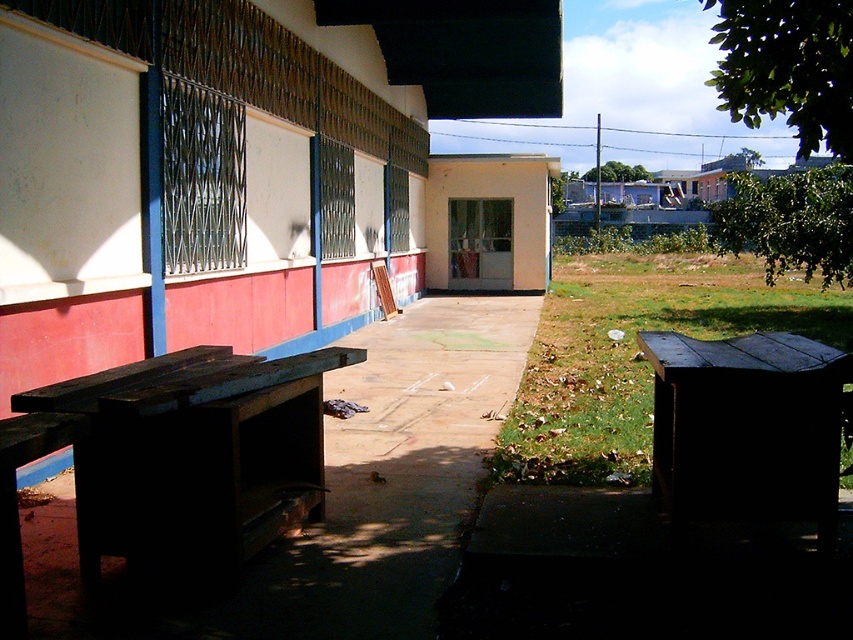
You are a visitor at this outdoor area and need to sit down. Which object, the dark wood bench at left or the beige matte hut at center, can accommodate more people due to its size?

The dark wood bench at left is larger in size than the beige matte hut at center, so it can accommodate more people.

You are planning to set up a small event in the outdoor area in front of the building. You need to place a 2.5 meters long banner between the dark wood bench at left and the dark wood picnic table at lower right. Is there enough space to place the banner between them?

The distance between the dark wood bench at left and the dark wood picnic table at lower right is 2.23 meters. Since the banner is 2.5 meters long, it is longer than the available space. Therefore, there is not enough space to place the banner between them.